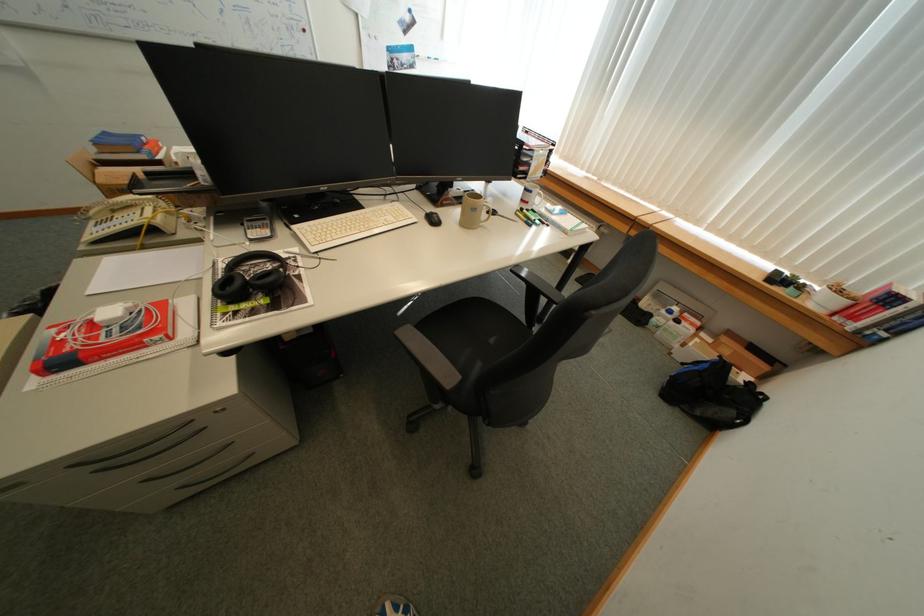
Where is `chair sitting surface`? The image size is (924, 616). chair sitting surface is located at coordinates (473, 333).